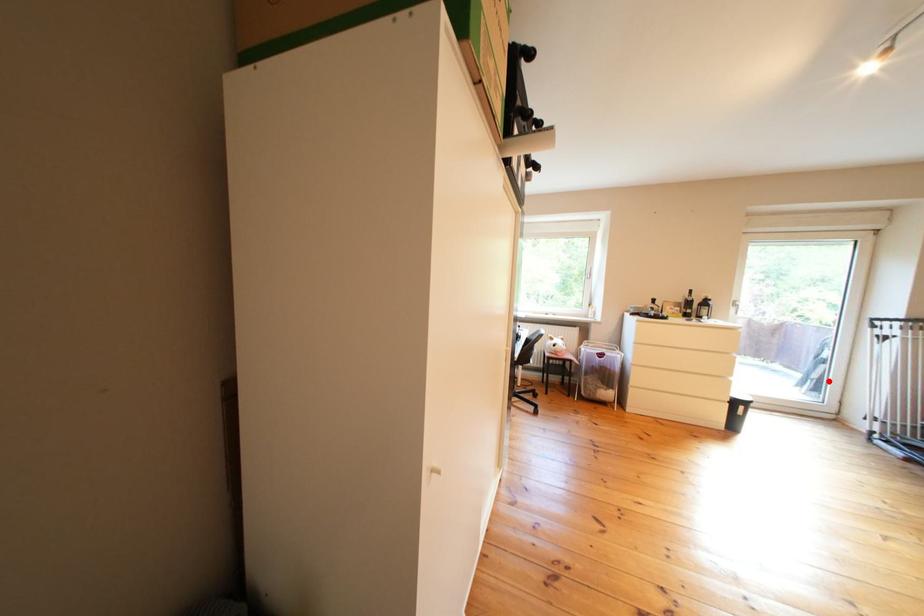
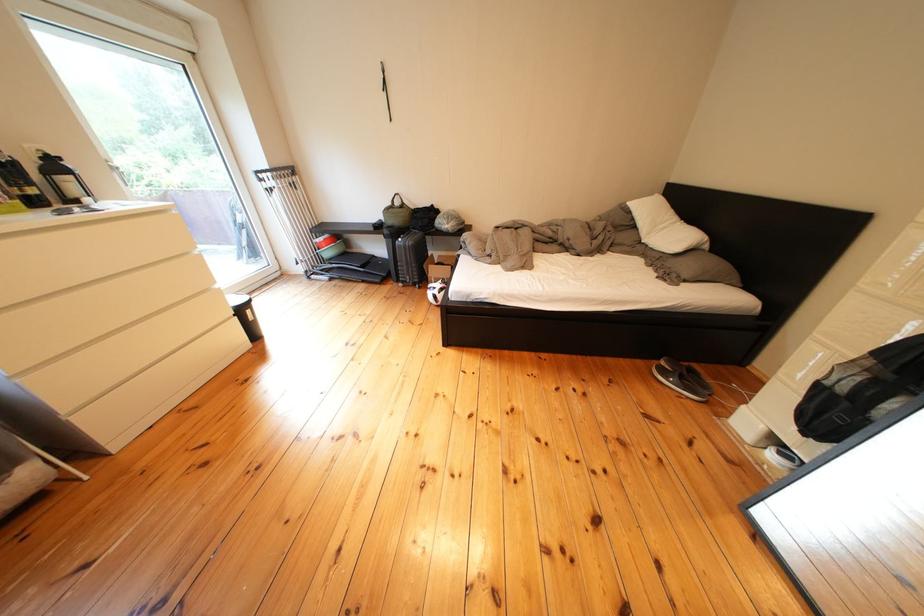
Locate, in the second image, the point that corresponds to the highlighted location in the first image.

(259, 248)